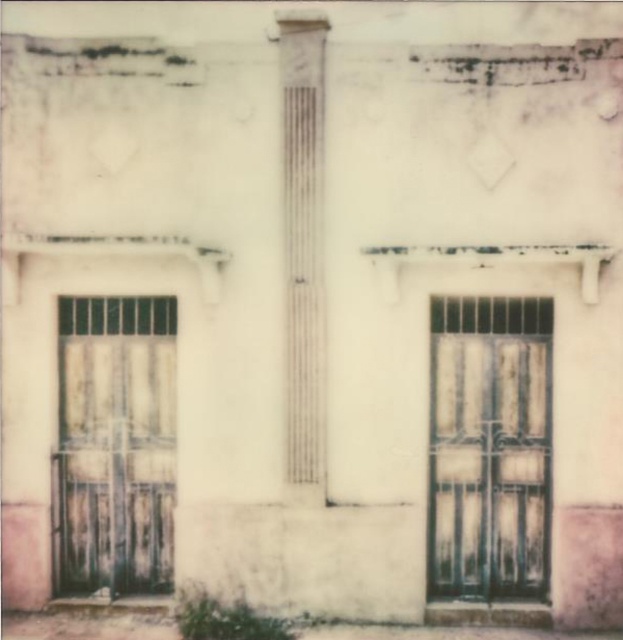
Is dark green wrought iron door at right to the left of white textured column at center from the viewer's perspective?

No, dark green wrought iron door at right is not to the left of white textured column at center.

You are a GUI agent. You are given a task and a screenshot of the screen. Output one action in this format:
    pyautogui.click(x=<x>, y=<y>)
    Task: Click on the dark green wrought iron door at right
    This screenshot has height=640, width=623.
    Given the screenshot: What is the action you would take?
    pyautogui.click(x=490, y=448)

Where is `dark green wrought iron door at right`? The image size is (623, 640). dark green wrought iron door at right is located at coordinates (490, 448).

Is rusty metal gate at left wider than white textured column at center?

Yes, rusty metal gate at left is wider than white textured column at center.

Is rusty metal gate at left above white textured column at center?

No.

Between point (69, 339) and point (297, 435), which one is positioned in front?

Point (297, 435) is more forward.

Identify the location of rusty metal gate at left. (115, 445).

Who is more forward, (440, 582) or (78, 516)?

Point (440, 582) is in front.

Between dark green wrought iron door at right and rusty metal gate at left, which one appears on the right side from the viewer's perspective?

dark green wrought iron door at right is more to the right.

Is point (510, 577) positioned in front of point (75, 484)?

That is True.

Find the location of a particular element. This screenshot has width=623, height=640. dark green wrought iron door at right is located at coordinates (490, 448).